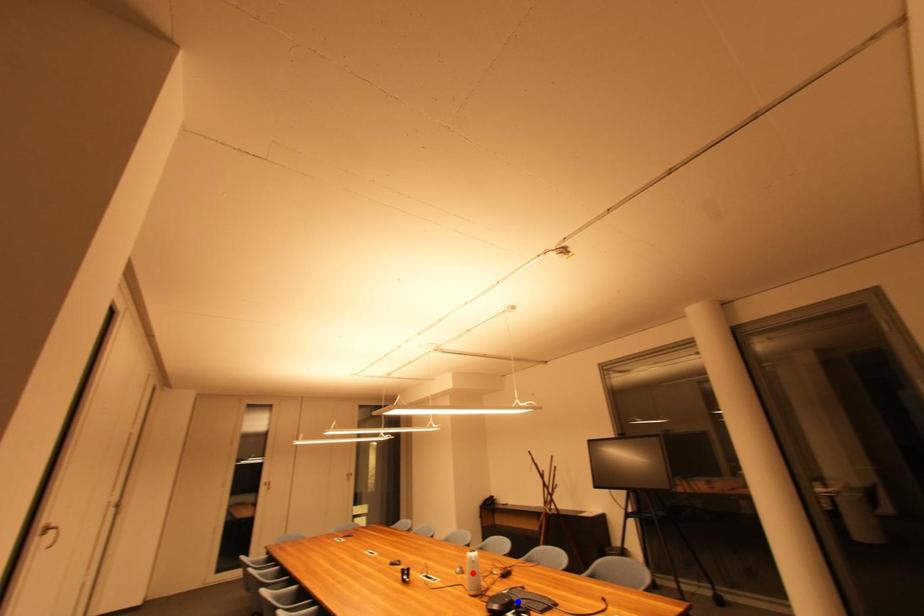
Question: In the image, two points are highlighted. Which point is nearer to the camera? Reply with the corresponding letter.

Choices:
 (A) blue point
 (B) red point

Answer: (A)